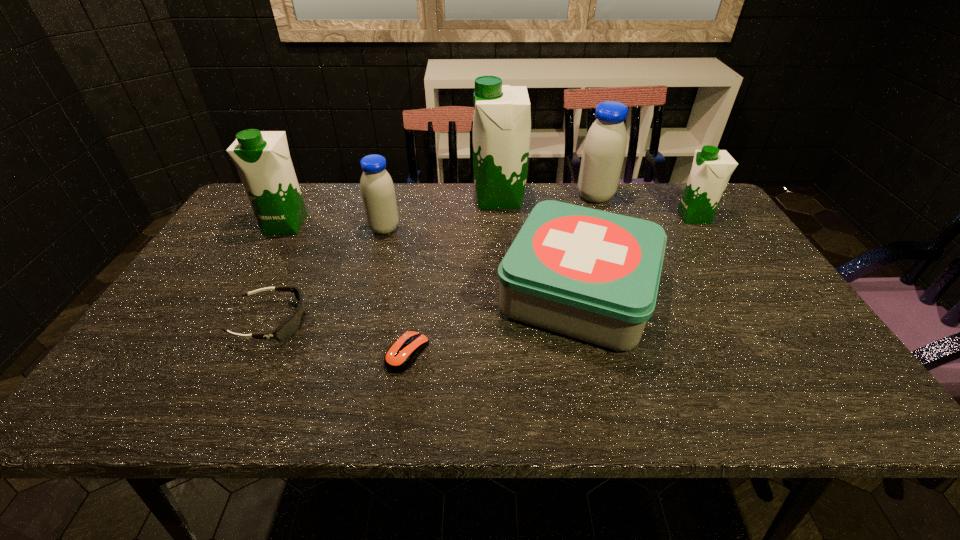
Identify the location of free space that satisfies the following two spatial constraints: 1. on the front side of the second soya milk from right to left; 2. on the front-facing side of the third soya milk from left to right. (596, 198).

In order to click on vacant space that satisfies the following two spatial constraints: 1. on the front side of the second soya milk from left to right; 2. on the right side of the teal first-aid kit in this screenshot , I will do `click(367, 292)`.